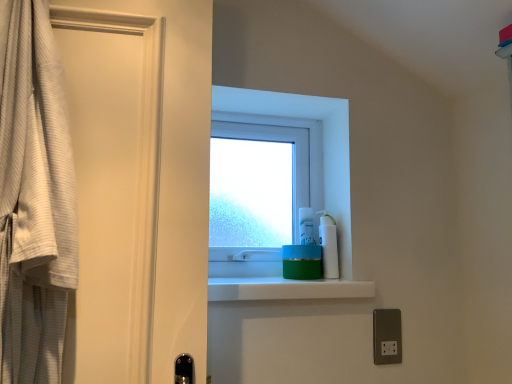
Question: Is point (326, 235) closer or farther from the camera than point (315, 235)?

Choices:
 (A) farther
 (B) closer

Answer: (B)

Question: Is white plastic pump bottle at upper right in front of or behind transparent plastic window at center in the image?

Choices:
 (A) front
 (B) behind

Answer: (A)

Question: Based on their relative distances, which object is farther from the white textured robe at left?

Choices:
 (A) transparent plastic window at center
 (B) green matte jar at center
 (C) metallic silver outlet at lower right
 (D) white plastic pump bottle at upper right

Answer: (C)

Question: Which of these objects is positioned closest to the metallic silver outlet at lower right?

Choices:
 (A) white plastic pump bottle at upper right
 (B) white textured robe at left
 (C) green matte jar at center
 (D) transparent plastic window at center

Answer: (A)